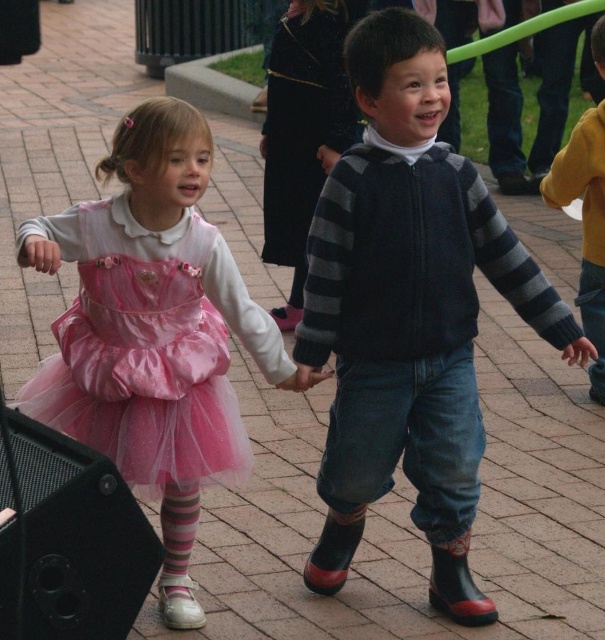
Question: Does pink satin dress at center have a lesser width compared to yellow sweater at right?

Choices:
 (A) yes
 (B) no

Answer: (B)

Question: Which is nearer to the striped knit sweater at center?

Choices:
 (A) pink satin dress at center
 (B) yellow sweater at right
 (C) pink tulle dress at lower left

Answer: (A)

Question: Is striped knit sweater at center to the left of yellow sweater at right from the viewer's perspective?

Choices:
 (A) no
 (B) yes

Answer: (B)

Question: Which object appears closest to the camera in this image?

Choices:
 (A) pink tulle dress at lower left
 (B) yellow sweater at right
 (C) pink satin dress at center

Answer: (C)

Question: Among these points, which one is nearest to the camera?

Choices:
 (A) (381, 198)
 (B) (31, 394)
 (C) (569, 138)
 (D) (128, 472)

Answer: (A)

Question: From the image, what is the correct spatial relationship of pink satin dress at center in relation to pink tulle dress at lower left?

Choices:
 (A) below
 (B) above

Answer: (A)